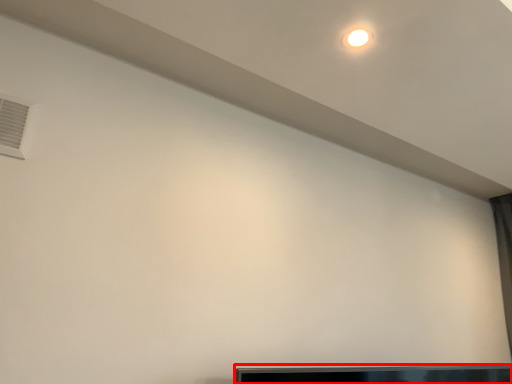
Question: From the image's perspective, considering the relative positions of furniture (annotated by the red box) and air conditioning in the image provided, where is furniture (annotated by the red box) located with respect to the staircase?

Choices:
 (A) above
 (B) below

Answer: (B)